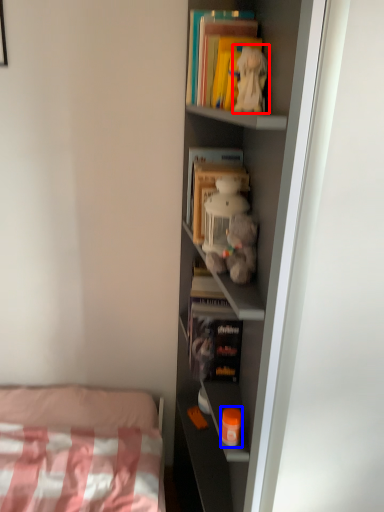
Question: Which of the following is the farthest to the observer, toy (highlighted by a red box) or toy (highlighted by a blue box)?

Choices:
 (A) toy
 (B) toy

Answer: (B)